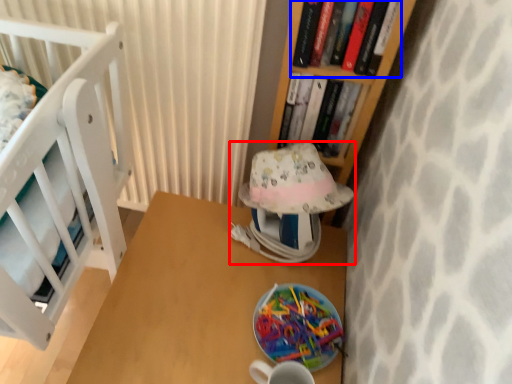
Question: Which object is further to the camera taking this photo, table lamp (highlighted by a red box) or book (highlighted by a blue box)?

Choices:
 (A) table lamp
 (B) book

Answer: (A)